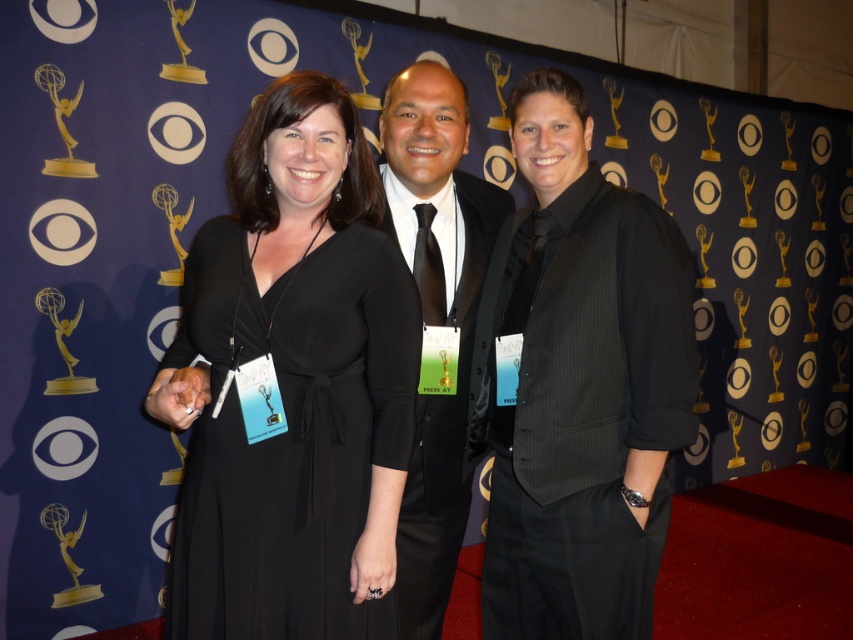
Question: Does black satin dress at center appear on the right side of black pinstripe suit at center?

Choices:
 (A) yes
 (B) no

Answer: (B)

Question: Which object is positioned closest to the matte black vest at center?

Choices:
 (A) black satin dress at center
 (B) black pinstripe suit at center

Answer: (B)

Question: Which of the following is the closest to the observer?

Choices:
 (A) black pinstripe suit at center
 (B) black satin dress at center
 (C) matte black vest at center

Answer: (B)

Question: Does matte black vest at center have a smaller size compared to black satin dress at center?

Choices:
 (A) no
 (B) yes

Answer: (A)

Question: Which object appears farthest from the camera in this image?

Choices:
 (A) matte black vest at center
 (B) black satin dress at center
 (C) black pinstripe suit at center

Answer: (A)

Question: Does matte black vest at center appear under black pinstripe suit at center?

Choices:
 (A) no
 (B) yes

Answer: (A)